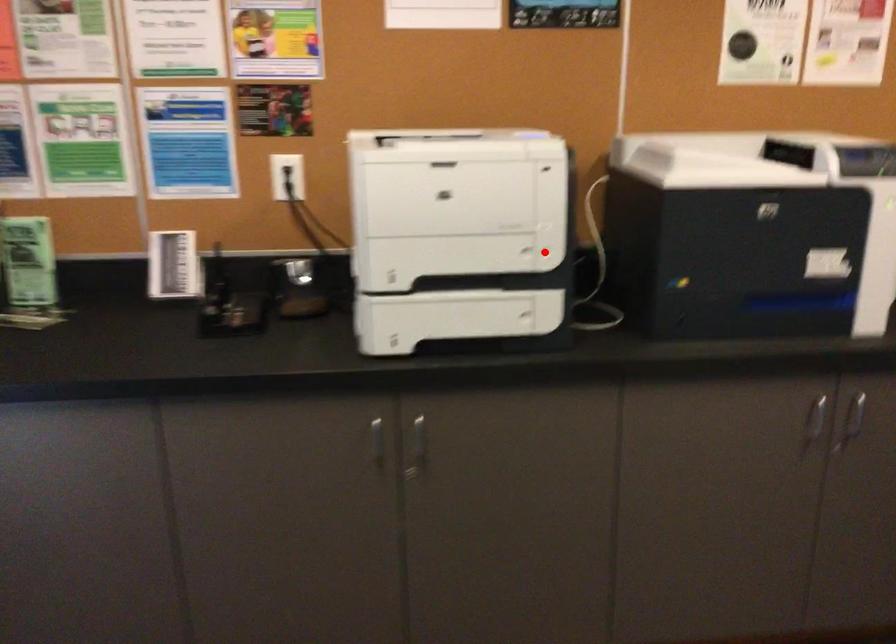
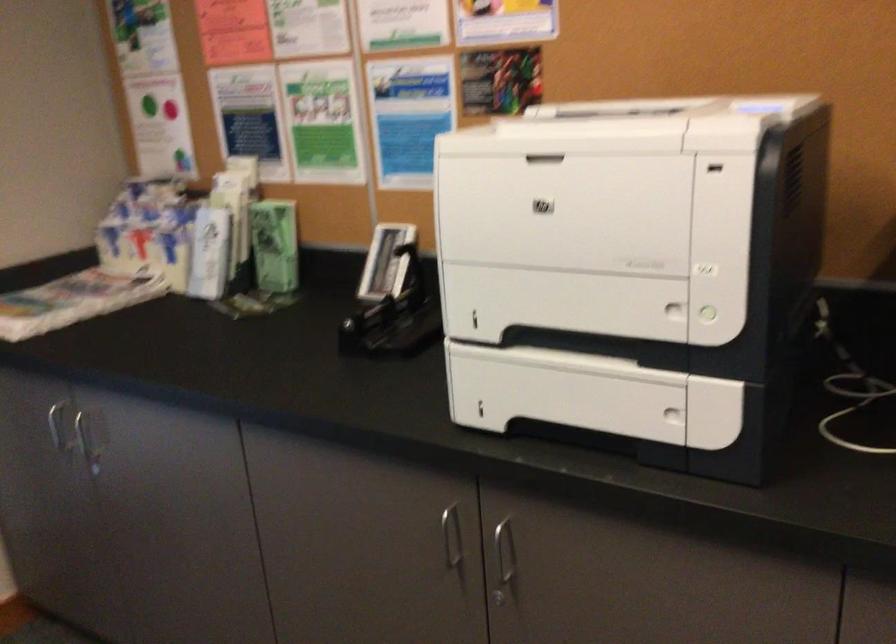
Question: I am providing you with two images of the same scene from different viewpoints. In image1, a red point is highlighted. Considering the same 3D point in image2, which of the following is correct?

Choices:
 (A) It is closer
 (B) It is farther

Answer: (A)